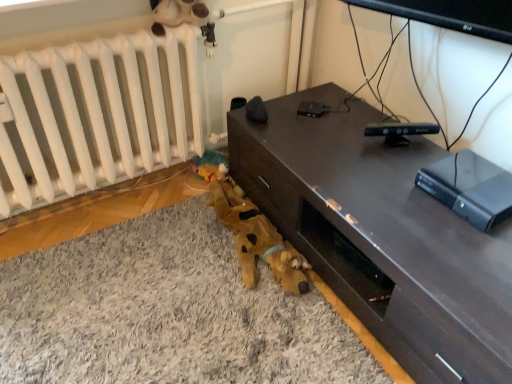
Locate an element on the screen. This screenshot has height=384, width=512. free space to the back side of black plastic gaming console at right is located at coordinates (433, 153).